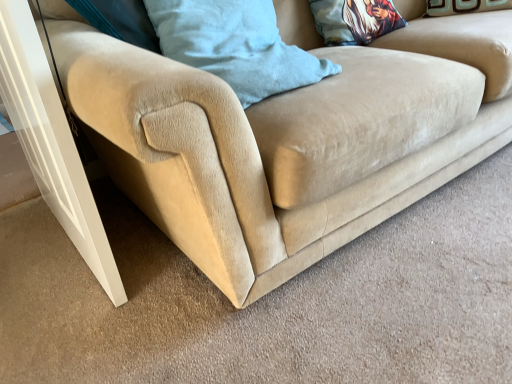
Question: Can you confirm if corduroy blue pillow at upper center, marked as the 1th pillow in a left-to-right arrangement, is wider than white glossy screen door at lower left?

Choices:
 (A) no
 (B) yes

Answer: (B)

Question: Considering the relative positions of corduroy blue pillow at upper center, marked as the 1th pillow in a left-to-right arrangement, and white glossy screen door at lower left in the image provided, is corduroy blue pillow at upper center, marked as the 1th pillow in a left-to-right arrangement, behind white glossy screen door at lower left?

Choices:
 (A) yes
 (B) no

Answer: (A)

Question: Is corduroy blue pillow at upper center, which appears as the first pillow when viewed from the front, bigger than white glossy screen door at lower left?

Choices:
 (A) no
 (B) yes

Answer: (A)

Question: Can you confirm if corduroy blue pillow at upper center, the 2th pillow positioned from the right, is smaller than white glossy screen door at lower left?

Choices:
 (A) no
 (B) yes

Answer: (B)

Question: Is corduroy blue pillow at upper center, which appears as the first pillow when viewed from the front, to the left of white glossy screen door at lower left from the viewer's perspective?

Choices:
 (A) no
 (B) yes

Answer: (A)

Question: From the image's perspective, relative to printed fabric pillow at upper center, arranged as the second pillow when viewed from the left, is white glossy screen door at lower left above or below?

Choices:
 (A) above
 (B) below

Answer: (B)

Question: Visually, is white glossy screen door at lower left positioned to the left or to the right of printed fabric pillow at upper center, arranged as the second pillow when viewed from the left?

Choices:
 (A) right
 (B) left

Answer: (B)

Question: Looking at the image, does white glossy screen door at lower left seem bigger or smaller compared to printed fabric pillow at upper center, the 2th pillow when ordered from front to back?

Choices:
 (A) big
 (B) small

Answer: (A)

Question: Does point (19, 119) appear closer or farther from the camera than point (328, 29)?

Choices:
 (A) closer
 (B) farther

Answer: (A)

Question: Does point tap(365, 13) appear closer or farther from the camera than point tap(232, 0)?

Choices:
 (A) farther
 (B) closer

Answer: (A)

Question: Looking at their shapes, would you say printed fabric pillow at upper center, the 2th pillow when ordered from front to back, is wider or thinner than corduroy blue pillow at upper center, the 2th pillow positioned from the right?

Choices:
 (A) wide
 (B) thin

Answer: (B)

Question: From a real-world perspective, is printed fabric pillow at upper center, acting as the 1th pillow starting from the back, above or below corduroy blue pillow at upper center, marked as the 1th pillow in a left-to-right arrangement?

Choices:
 (A) above
 (B) below

Answer: (B)

Question: From the image's perspective, is printed fabric pillow at upper center, arranged as the second pillow when viewed from the left, located above or below corduroy blue pillow at upper center, the 2th pillow positioned from the right?

Choices:
 (A) below
 (B) above

Answer: (B)

Question: In terms of width, does printed fabric pillow at upper center, acting as the 1th pillow starting from the back, look wider or thinner when compared to white glossy screen door at lower left?

Choices:
 (A) thin
 (B) wide

Answer: (B)

Question: Is printed fabric pillow at upper center, acting as the 1th pillow starting from the back, spatially inside white glossy screen door at lower left, or outside of it?

Choices:
 (A) outside
 (B) inside

Answer: (A)